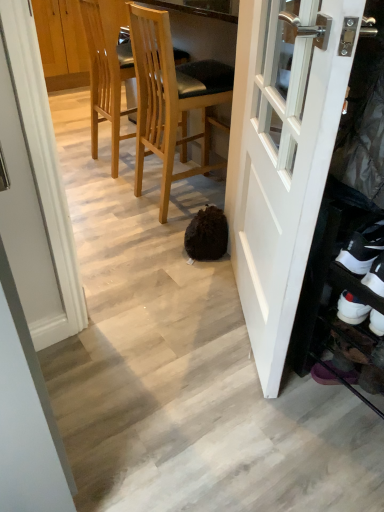
Question: Is white suede shoe at lower right, marked as the second shoe in a back-to-front arrangement, wider or thinner than light brown wood chair at center, the 1th chair in the left-to-right sequence?

Choices:
 (A) thin
 (B) wide

Answer: (A)

Question: Visually, is white suede shoe at lower right, marked as the second shoe in a back-to-front arrangement, positioned to the left or to the right of light brown wood chair at center, which ranks as the 2th chair in right-to-left order?

Choices:
 (A) right
 (B) left

Answer: (A)

Question: Which is farther from the white glossy door at right?

Choices:
 (A) white suede shoe at lower right, marked as the first shoe in a front-to-back arrangement
 (B) light brown wood chair at center, which is counted as the 1th chair, starting from the right
 (C) white suede shoe at lower right, acting as the 2th shoe starting from the front
 (D) light brown wood chair at center, the 1th chair in the left-to-right sequence

Answer: (D)

Question: Considering the real-world distances, which object is closest to the light brown wood chair at center, the 1th chair in the left-to-right sequence?

Choices:
 (A) white suede shoe at lower right, marked as the second shoe in a back-to-front arrangement
 (B) light brown wood chair at center, which is counted as the 1th chair, starting from the right
 (C) white suede shoe at lower right, placed as the first shoe when sorted from back to front
 (D) white glossy door at right

Answer: (B)